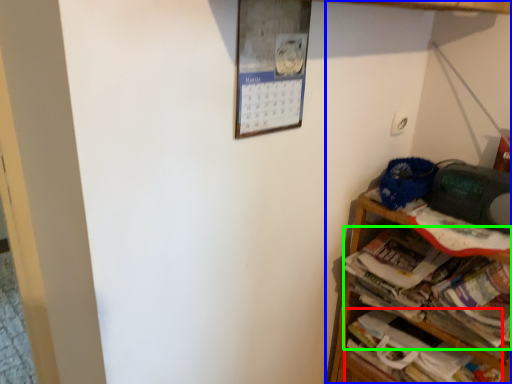
Question: Which object is the closest to the book (highlighted by a red box)? Choose among these: shelf (highlighted by a blue box) or magazine (highlighted by a green box).

Choices:
 (A) shelf
 (B) magazine

Answer: (A)